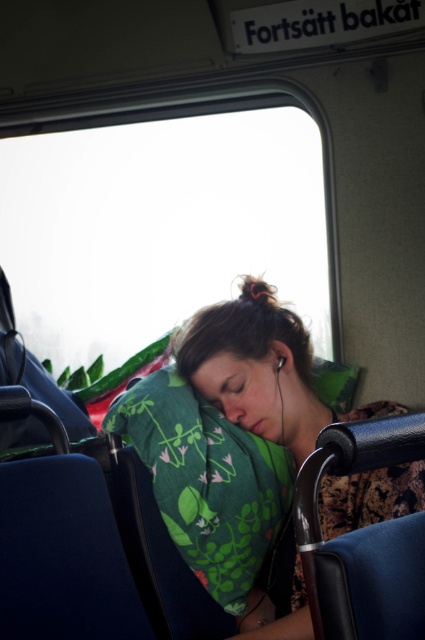
Question: Is transparent glass window at upper center thinner than green floral pillow at center?

Choices:
 (A) no
 (B) yes

Answer: (A)

Question: Is green floral pillow at center above green fabric pillow at center?

Choices:
 (A) no
 (B) yes

Answer: (B)

Question: Is transparent glass window at upper center behind green fabric pillow at center?

Choices:
 (A) yes
 (B) no

Answer: (A)

Question: Which object appears closest to the camera in this image?

Choices:
 (A) green floral pillow at center
 (B) green fabric pillow at center
 (C) transparent glass window at upper center

Answer: (A)

Question: Which object is farther from the camera taking this photo?

Choices:
 (A) green fabric pillow at center
 (B) green floral pillow at center

Answer: (A)

Question: Which object appears closest to the camera in this image?

Choices:
 (A) green floral pillow at center
 (B) transparent glass window at upper center

Answer: (A)